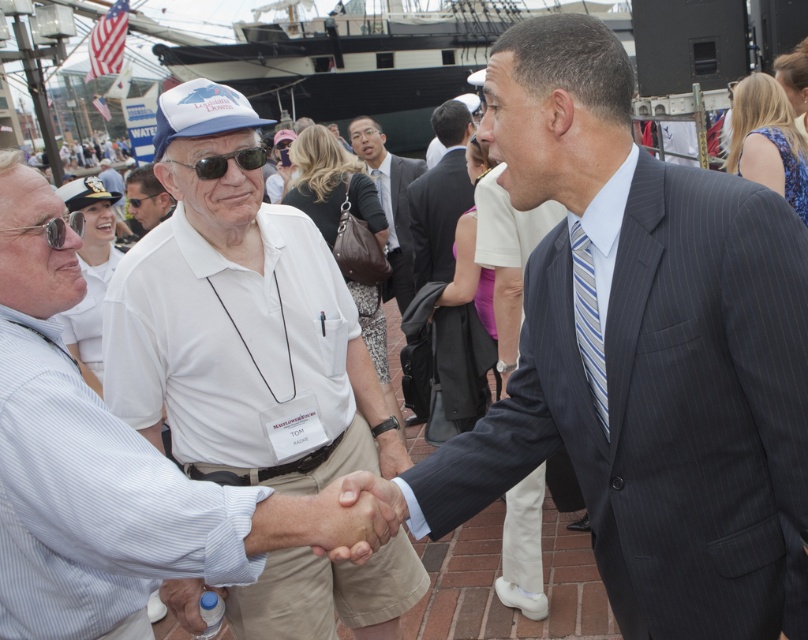
Question: Which point appears farthest from the camera in this image?

Choices:
 (A) (697, 211)
 (B) (432, 168)

Answer: (B)

Question: Can you confirm if white matte shirt at center is thinner than matte white cap at center?

Choices:
 (A) yes
 (B) no

Answer: (A)

Question: Can you confirm if matte black suit at center is thinner than sunglasses at center?

Choices:
 (A) no
 (B) yes

Answer: (B)

Question: Which point is farther from the camera taking this photo?

Choices:
 (A) click(452, 104)
 (B) click(369, 124)
 (C) click(259, 148)

Answer: (B)

Question: Can you confirm if dark gray pinstripe suit at center is thinner than sunglasses at center?

Choices:
 (A) no
 (B) yes

Answer: (A)

Question: Which point is closer to the camera taking this photo?

Choices:
 (A) (0, 596)
 (B) (225, 154)

Answer: (A)